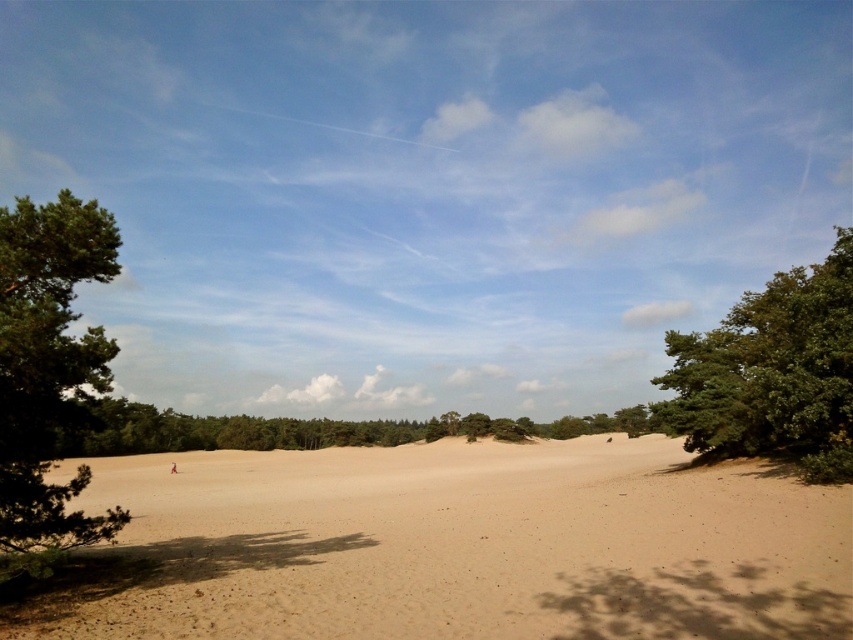
Does beige sandy dunes at center appear on the left side of green textured tree at left?

No, beige sandy dunes at center is not to the left of green textured tree at left.

Can you confirm if beige sandy dunes at center is bigger than green textured tree at left?

Yes.

This screenshot has height=640, width=853. Find the location of `beige sandy dunes at center`. beige sandy dunes at center is located at coordinates (456, 547).

Does green textured tree at left have a smaller size compared to green leafy tree at center?

Indeed, green textured tree at left has a smaller size compared to green leafy tree at center.

Who is positioned more to the right, green textured tree at left or green leafy tree at center?

Positioned to the right is green leafy tree at center.

Is point (45, 464) closer to camera compared to point (412, 440)?

That is True.

I want to click on green textured tree at left, so click(49, 364).

Does green leafy tree at right have a smaller size compared to green leafy tree at center?

Incorrect, green leafy tree at right is not smaller in size than green leafy tree at center.

Does point (827, 269) come closer to viewer compared to point (219, 445)?

Yes, point (827, 269) is closer to viewer.

The image size is (853, 640). Identify the location of green leafy tree at right. (772, 371).